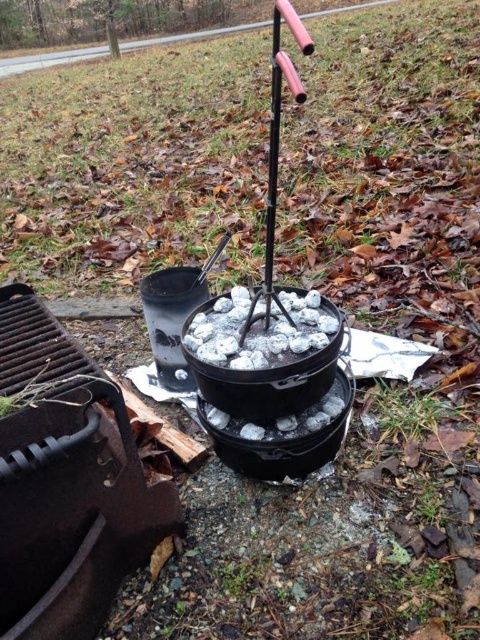
You are setting up a campfire cooking area and need to place a new item between the black cast iron grill at lower left and the black cast iron pot at center. Is there enough space to place the item between them?

The black cast iron grill at lower left is to the left of black cast iron pot at center, so there is space between them to place the new item.

You are setting up a campfire cooking area and have both the black cast iron grill at lower left and the black cast iron pot at center. Which one requires more vertical space to accommodate its height?

The black cast iron grill at lower left requires more vertical space because it is much taller than the black cast iron pot at center.

You are setting up a campsite and need to place a tent. The tent requires a clear area of 1 meter in diameter. Given the black cast iron grill at lower left is at point 0.755, 0.140, can you place the tent without overlapping the grill?

The black cast iron grill at lower left is located at point (67, 483). Since the tent requires a clear area of 1 meter in diameter, you need to ensure the distance between the tent and the grill is sufficient. However, without knowing the exact scale of the coordinates, it is impossible to determine if the tent will overlap with the grill. Please provide more information about the coordinate system scale.